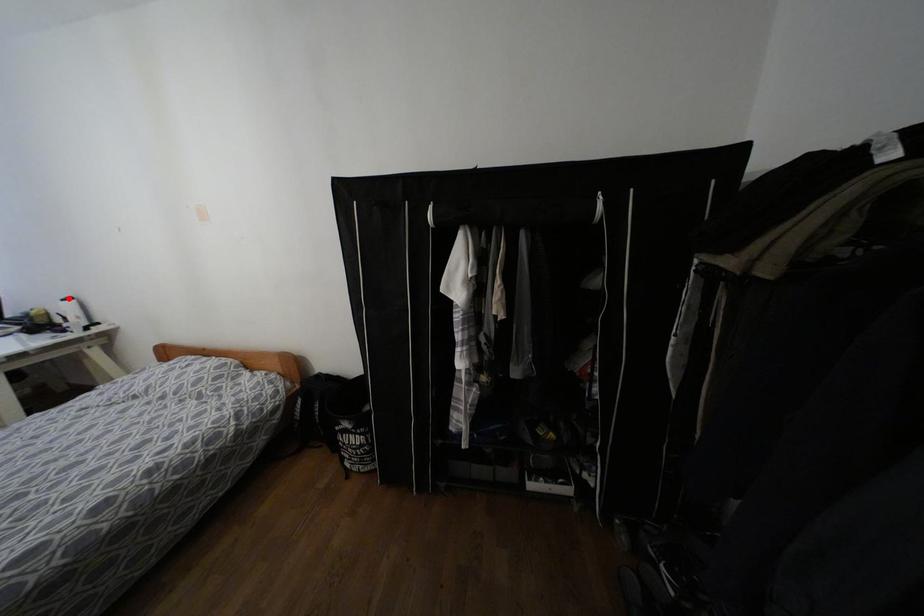
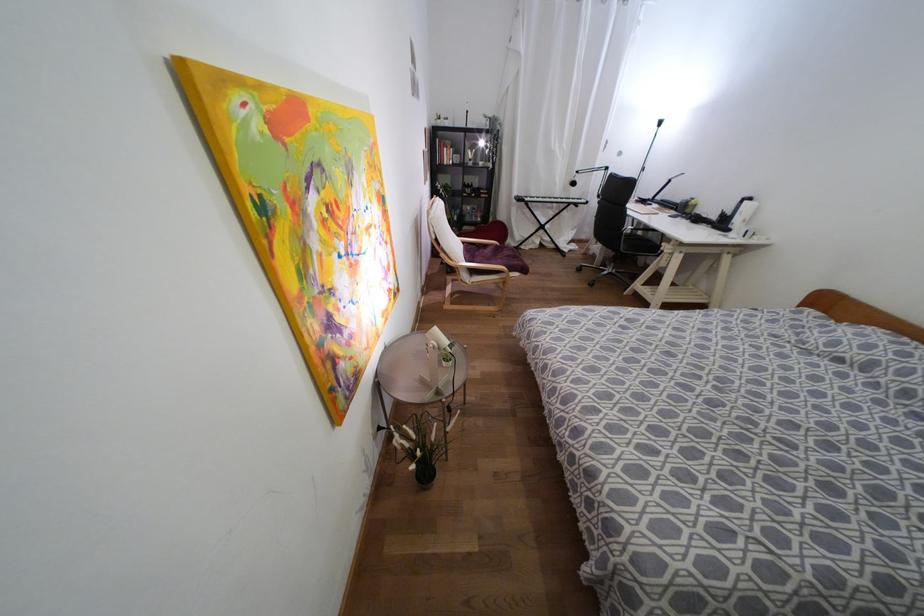
Find the pixel in the second image that matches the highlighted location in the first image.

(749, 198)